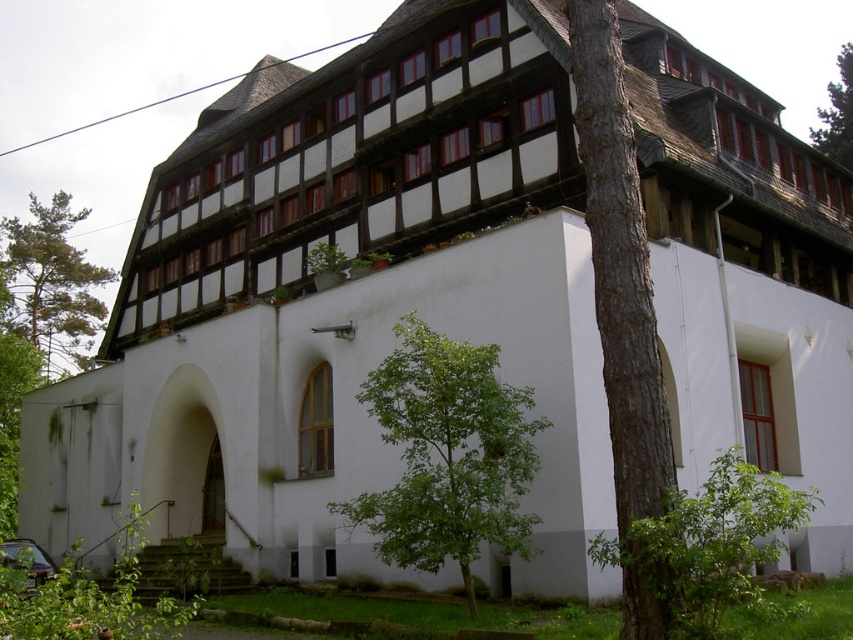
Question: Can you confirm if green leafy tree at center is positioned above green leafy tree at upper right?

Choices:
 (A) no
 (B) yes

Answer: (A)

Question: Which is nearer to the green leafy tree at upper right?

Choices:
 (A) green leafy tree at left
 (B) brown rough bark tree at center

Answer: (B)

Question: Is green leafy tree at center below green leafy tree at upper right?

Choices:
 (A) no
 (B) yes

Answer: (B)

Question: Estimate the real-world distances between objects in this image. Which object is closer to the green leafy tree at left?

Choices:
 (A) green leafy tree at upper right
 (B) green leafy tree at center
 (C) brown rough bark tree at center

Answer: (B)

Question: Observing the image, what is the correct spatial positioning of green leafy tree at left in reference to green leafy tree at upper right?

Choices:
 (A) below
 (B) above

Answer: (A)

Question: Which point appears farthest from the camera in this image?

Choices:
 (A) (521, 426)
 (B) (51, 208)
 (C) (592, 108)
 (D) (840, 138)

Answer: (B)